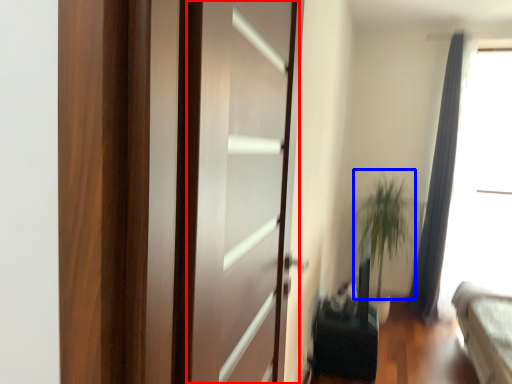
Question: Which of the following is the closest to the observer, screen door (highlighted by a red box) or plant (highlighted by a blue box)?

Choices:
 (A) screen door
 (B) plant

Answer: (A)